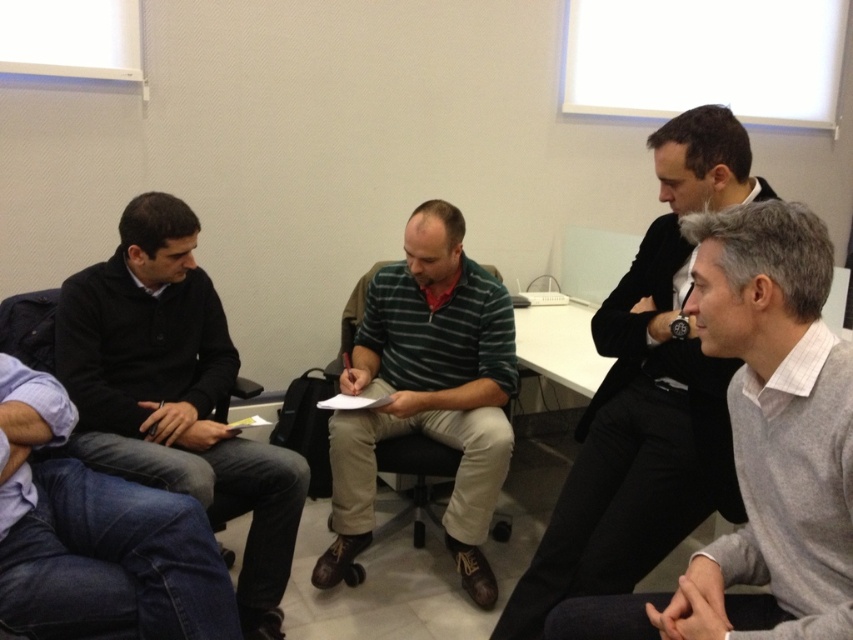
Question: Estimate the real-world distances between objects in this image. Which object is farther from the dark gray suit at right?

Choices:
 (A) dark gray sweater at left
 (B) jeans at lower left
 (C) green striped sweater at center

Answer: (A)

Question: Can you confirm if dark gray suit at right is bigger than green striped sweater at center?

Choices:
 (A) no
 (B) yes

Answer: (B)

Question: Is dark gray sweater at left closer to the viewer compared to green striped sweater at center?

Choices:
 (A) no
 (B) yes

Answer: (B)

Question: Which point appears farthest from the camera in this image?

Choices:
 (A) (674, 413)
 (B) (389, 384)
 (C) (91, 266)
 (D) (33, 444)

Answer: (B)

Question: Does green striped sweater at center appear over jeans at lower left?

Choices:
 (A) yes
 (B) no

Answer: (A)

Question: Considering the real-world distances, which object is farthest from the green striped sweater at center?

Choices:
 (A) dark gray sweater at left
 (B) dark gray suit at right

Answer: (B)